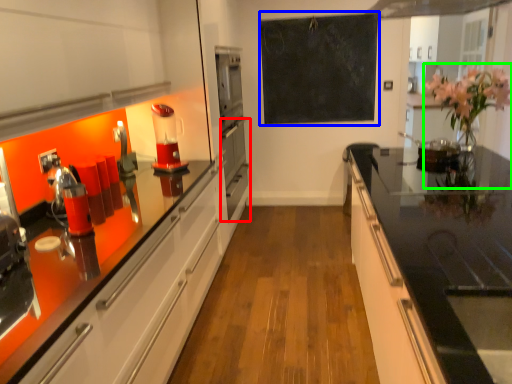
Question: Which object is positioned closest to oven (highlighted by a red box)? Select from bulletin board (highlighted by a blue box) and floral arrangement (highlighted by a green box).

Choices:
 (A) bulletin board
 (B) floral arrangement

Answer: (A)